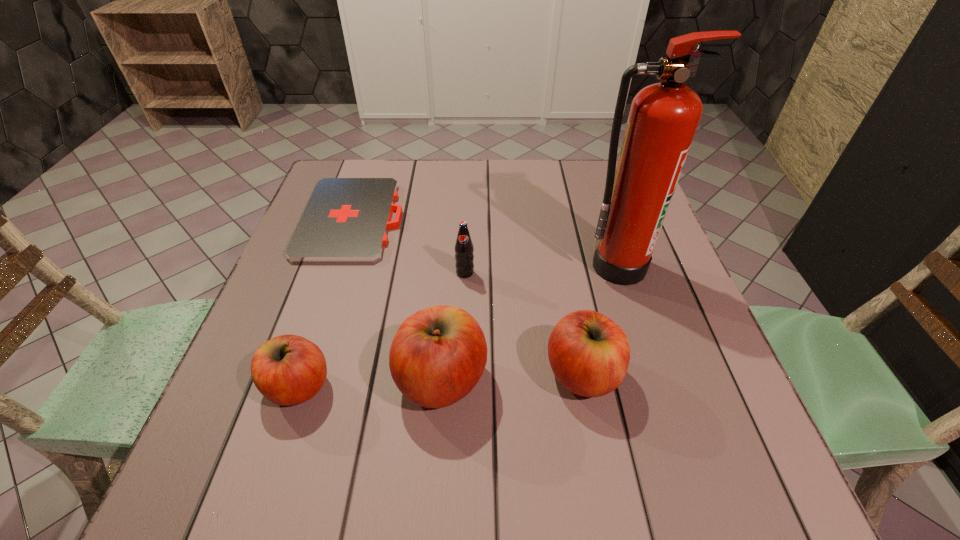
In order to click on vacant space located on the front label of the pop in this screenshot , I will do `click(464, 306)`.

The width and height of the screenshot is (960, 540). Identify the location of vacant space located on handle side the first-aid kit. (508, 220).

You are a GUI agent. You are given a task and a screenshot of the screen. Output one action in this format:
    pyautogui.click(x=<x>, y=<y>)
    Task: Click on the vacant space located 0.180m with the nozzle pointing from the back of the fire extinguisher
    The width and height of the screenshot is (960, 540).
    Given the screenshot: What is the action you would take?
    pyautogui.click(x=644, y=352)

This screenshot has height=540, width=960. What are the coordinates of `object at the far edge` in the screenshot? It's located at (346, 220).

The width and height of the screenshot is (960, 540). What are the coordinates of `apple that is at the left edge` in the screenshot? It's located at (288, 370).

This screenshot has width=960, height=540. I want to click on the first-aid kit situated at the left edge, so [346, 220].

What are the coordinates of `object located at the right edge` in the screenshot? It's located at (663, 119).

You are a GUI agent. You are given a task and a screenshot of the screen. Output one action in this format:
    pyautogui.click(x=<x>, y=<y>)
    Task: Click on the object present at the far left corner
    The width and height of the screenshot is (960, 540).
    Given the screenshot: What is the action you would take?
    pyautogui.click(x=346, y=220)

At what (x,y) coordinates should I click in order to perform the action: click on object positioned at the near left corner. Please return your answer as a coordinate pair (x, y). Looking at the image, I should click on (288, 370).

This screenshot has height=540, width=960. Find the location of `vacant region at the far edge`. vacant region at the far edge is located at coordinates (433, 171).